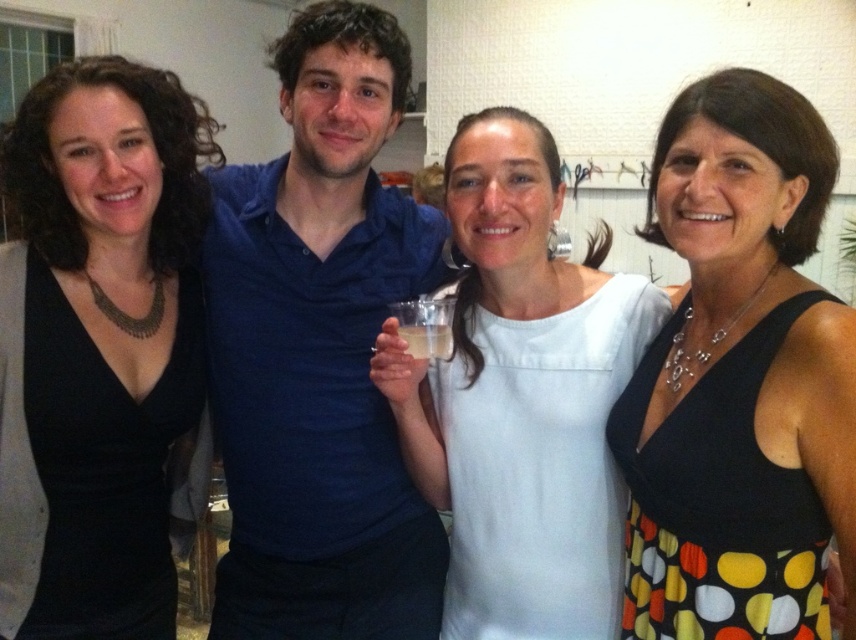
Can you confirm if black dotted dress at center is positioned to the left of clear plastic cup at center?

In fact, black dotted dress at center is to the right of clear plastic cup at center.

Can you confirm if black dotted dress at center is taller than clear plastic cup at center?

Correct, black dotted dress at center is much taller as clear plastic cup at center.

Measure the distance between black dotted dress at center and camera.

black dotted dress at center is 34.70 inches from camera.

Where is `black dotted dress at center`? black dotted dress at center is located at coordinates (740, 381).

Between white fabric dress at center and clear plastic cup at center, which one is positioned lower?

white fabric dress at center is below.

Between white fabric dress at center and clear plastic cup at center, which one is positioned higher?

clear plastic cup at center

Does point (498, 432) come farther from viewer compared to point (444, 337)?

Yes, it is behind point (444, 337).

Locate an element on the screen. Image resolution: width=856 pixels, height=640 pixels. white fabric dress at center is located at coordinates (522, 397).

Which is in front, point (354, 566) or point (551, 564)?

Point (551, 564) is in front.

Between blue cotton shirt at center and white fabric dress at center, which one is positioned lower?

Positioned lower is white fabric dress at center.

Is point (287, 531) farther from viewer compared to point (562, 429)?

Yes, point (287, 531) is farther from viewer.

You are a GUI agent. You are given a task and a screenshot of the screen. Output one action in this format:
    pyautogui.click(x=<x>, y=<y>)
    Task: Click on the blue cotton shirt at center
    Image resolution: width=856 pixels, height=640 pixels.
    Given the screenshot: What is the action you would take?
    319,352